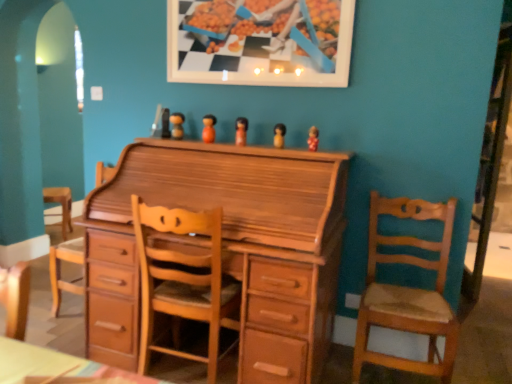
The width and height of the screenshot is (512, 384). Identify the location of free space in front of wooden figurine at center, marked as the 3th toy in a right-to-left arrangement. (243, 147).